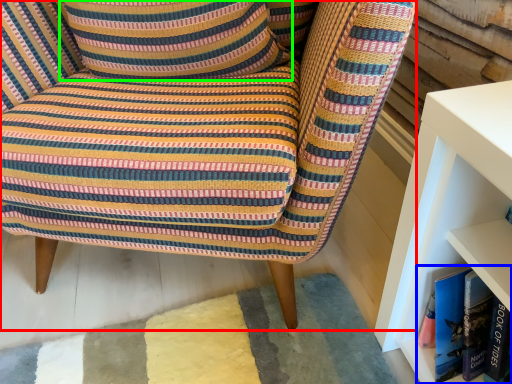
Question: Which is farther away from chair (highlighted by a red box)? book (highlighted by a blue box) or pillow (highlighted by a green box)?

Choices:
 (A) book
 (B) pillow

Answer: (A)